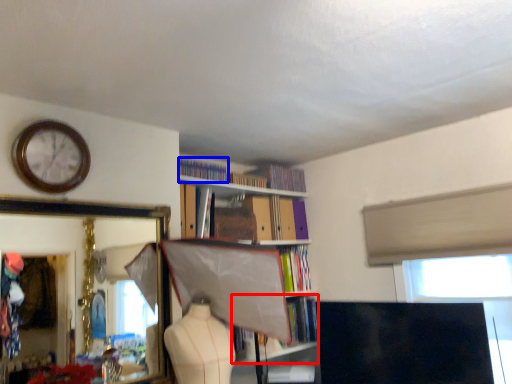
Question: Which point is closer to the camera, book (highlighted by a red box) or book (highlighted by a blue box)?

Choices:
 (A) book
 (B) book

Answer: (B)